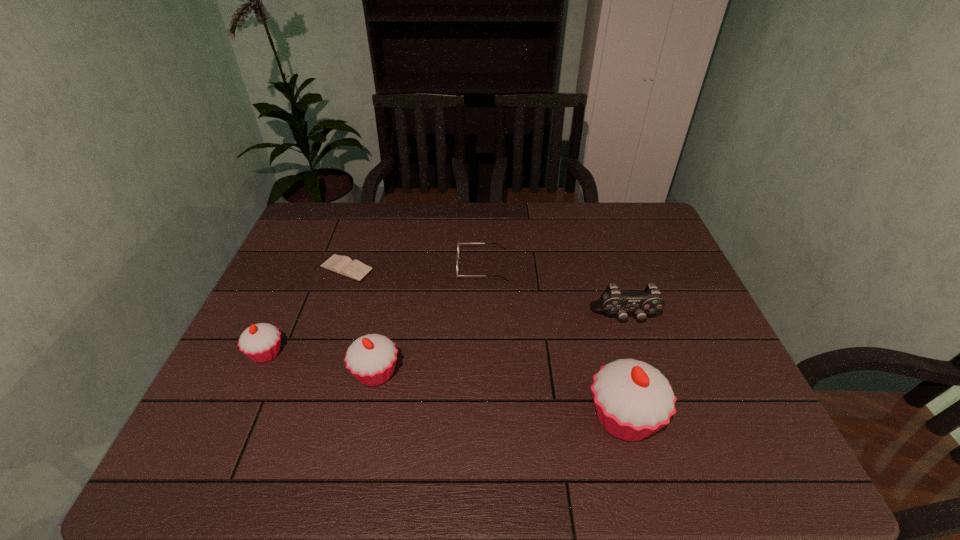
If equal spacing is desired by inserting an extra cupcake among them, please point out a free spot for this new cupcake. Please provide its 2D coordinates. Your answer should be formatted as a tuple, i.e. [(x, y)], where the tuple contains the x and y coordinates of a point satisfying the conditions above.

[(494, 394)]